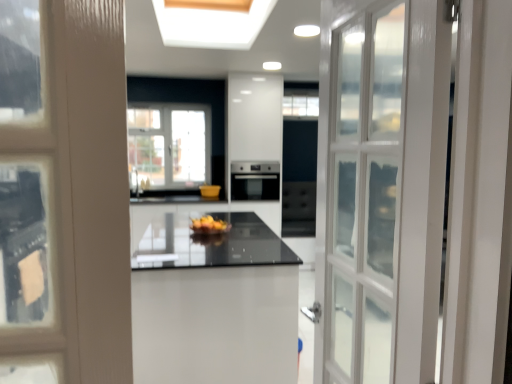
Question: Does satin black oven at center come behind yellow matte bowl at center?

Choices:
 (A) no
 (B) yes

Answer: (B)

Question: From a real-world perspective, is satin black oven at center positioned under yellow matte bowl at center based on gravity?

Choices:
 (A) yes
 (B) no

Answer: (B)

Question: Can you confirm if satin black oven at center is smaller than yellow matte bowl at center?

Choices:
 (A) no
 (B) yes

Answer: (A)

Question: Is satin black oven at center thinner than yellow matte bowl at center?

Choices:
 (A) yes
 (B) no

Answer: (B)

Question: Can you confirm if satin black oven at center is taller than yellow matte bowl at center?

Choices:
 (A) no
 (B) yes

Answer: (B)

Question: Is white glossy table at center wider or thinner than yellow matte bowl at center?

Choices:
 (A) wide
 (B) thin

Answer: (A)

Question: Would you say white glossy table at center is to the left or to the right of yellow matte bowl at center in the picture?

Choices:
 (A) right
 (B) left

Answer: (B)

Question: From a real-world perspective, is white glossy table at center physically located above or below yellow matte bowl at center?

Choices:
 (A) above
 (B) below

Answer: (B)

Question: From the image's perspective, relative to yellow matte bowl at center, is white glossy table at center above or below?

Choices:
 (A) below
 (B) above

Answer: (A)

Question: Is point (238, 185) closer or farther from the camera than point (138, 254)?

Choices:
 (A) farther
 (B) closer

Answer: (A)

Question: Is satin black oven at center inside or outside of white glossy table at center?

Choices:
 (A) inside
 (B) outside

Answer: (B)

Question: From the image's perspective, relative to white glossy table at center, is satin black oven at center above or below?

Choices:
 (A) below
 (B) above

Answer: (B)

Question: In terms of size, does satin black oven at center appear bigger or smaller than white glossy table at center?

Choices:
 (A) big
 (B) small

Answer: (B)

Question: Is satin black oven at center taller or shorter than yellow matte bowl at center?

Choices:
 (A) short
 (B) tall

Answer: (B)

Question: Based on their positions, is satin black oven at center located to the left or right of yellow matte bowl at center?

Choices:
 (A) right
 (B) left

Answer: (A)